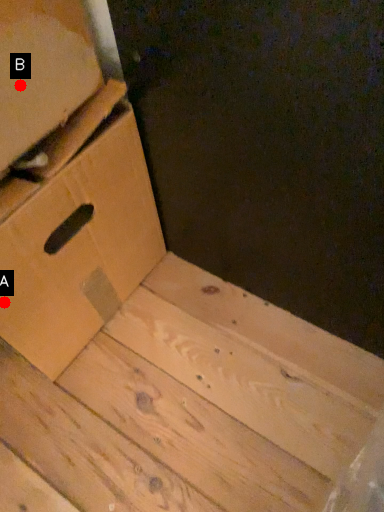
Question: Two points are circled on the image, labeled by A and B beside each circle. Among these points, which one is nearest to the camera?

Choices:
 (A) A is closer
 (B) B is closer

Answer: (B)